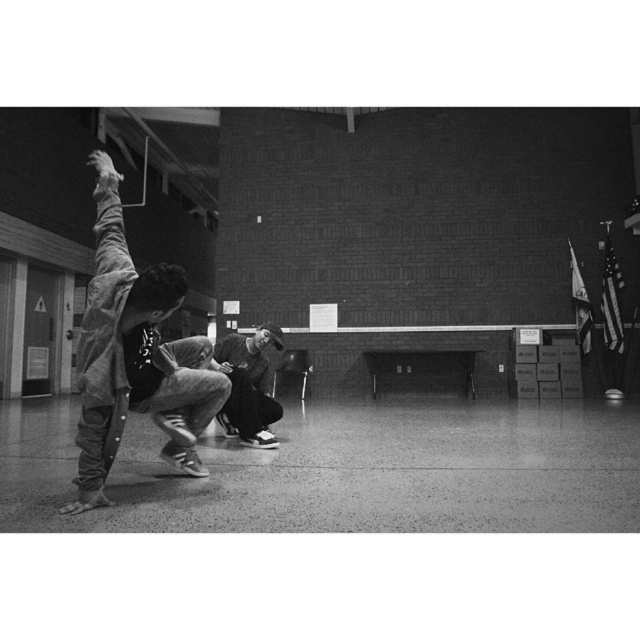
You are setting up a photo shoot in the gymnasium and need to place the matte black skateboard at left and the dark gray hoodie at center. Since you want to emphasize their sizes, which object should you place closer to the camera to make it appear larger?

The matte black skateboard at left is wider than the dark gray hoodie at center, so placing the skateboard closer to the camera will make it appear larger due to its actual width combined with proximity.

You are a photographer setting up for a photoshoot in the gymnasium. You need to place a matte black skateboard at left and a dark gray hoodie at center in the scene. According to the image, which object is placed higher?

The matte black skateboard at left is positioned over the dark gray hoodie at center, so it is placed higher.

From the picture: You are a photographer setting up equipment in the gymnasium. You need to place a tripod between the matte black skateboard at left and the dark gray hoodie at center. Since the hoodie is lower, where should you position the tripod to avoid blocking the skateboard?

The matte black skateboard at left is taller than the dark gray hoodie at center, so positioning the tripod closer to the dark gray hoodie at center will ensure it doesn not block the skateboard.